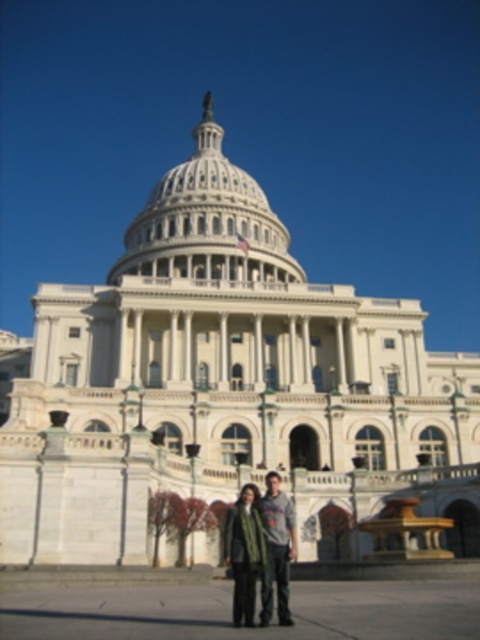
Question: Does white marble dome at center appear over dark gray sweater at center?

Choices:
 (A) no
 (B) yes

Answer: (B)

Question: Is white marble dome at center below dark gray sweater at center?

Choices:
 (A) yes
 (B) no

Answer: (B)

Question: Is white marble dome at center behind dark gray sweater at center?

Choices:
 (A) no
 (B) yes

Answer: (B)

Question: Which point is farther from the camera taking this photo?

Choices:
 (A) (232, 524)
 (B) (216, 125)

Answer: (B)

Question: Which point is farther to the camera?

Choices:
 (A) (176, 262)
 (B) (242, 502)

Answer: (A)